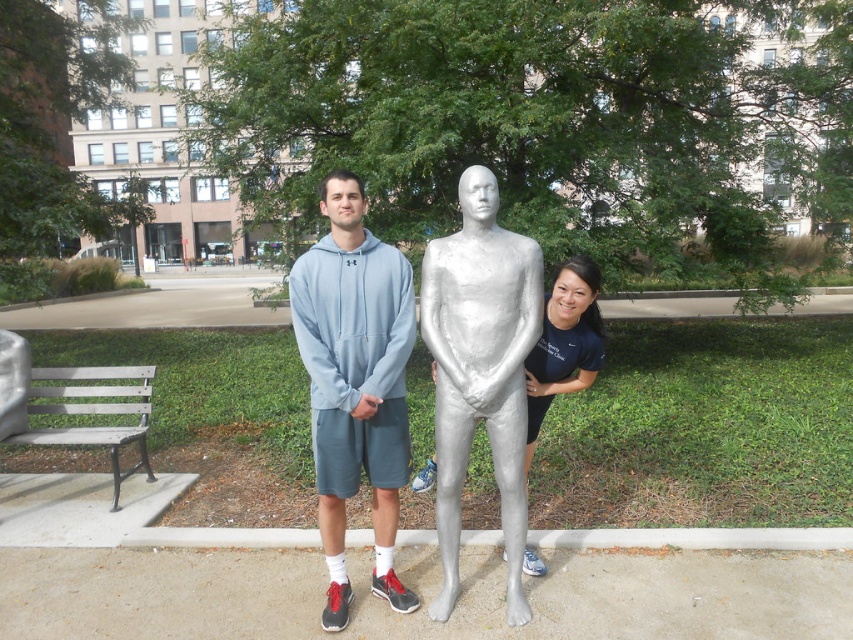
You are a photographer wanting to capture both the light blue hoodie at center and the silver metallic statue at center in the same frame. Based on their sizes, which object should you focus on first to ensure both fit in the photo?

The light blue hoodie at center is bigger than the silver metallic statue at center, so you should focus on the light blue hoodie at center first to ensure both fit in the photo.

You are a photographer trying to capture both the light blue hoodie at center and the silver metallic statue at center in the same frame. Based on their positions, which object should you focus on first to ensure both are in the frame?

The light blue hoodie at center is located above the silver metallic statue at center, so you should focus on the silver metallic statue at center first to ensure both are in the frame.

You are planning to take a photo of the silver metallic mannequin at center and the wooden slats bench at lower left. Which object should you focus on first if you want to capture both in the same frame without moving the camera?

You should focus on the silver metallic mannequin at center first because it is much taller than the wooden slats bench at lower left, ensuring it is properly in focus while the bench will naturally be included in the frame.